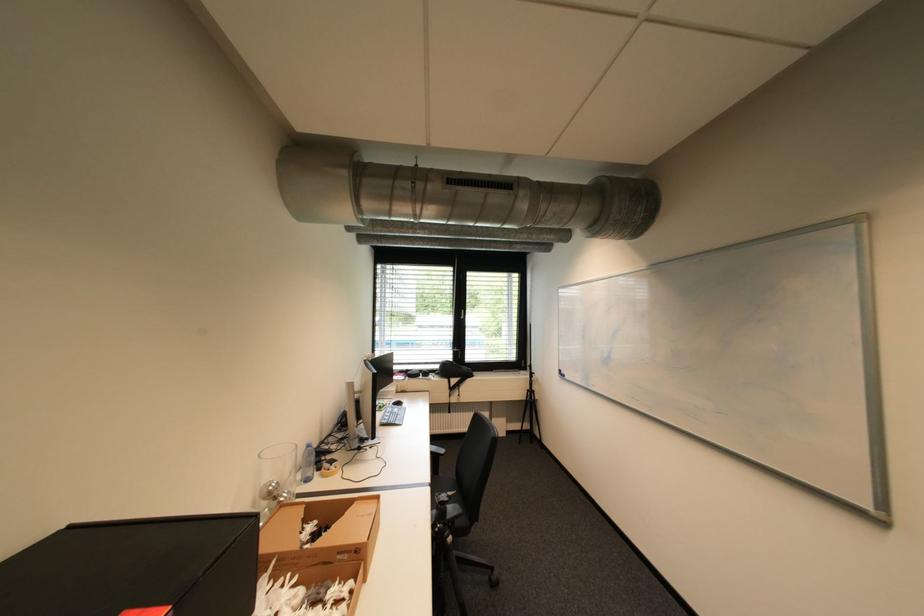
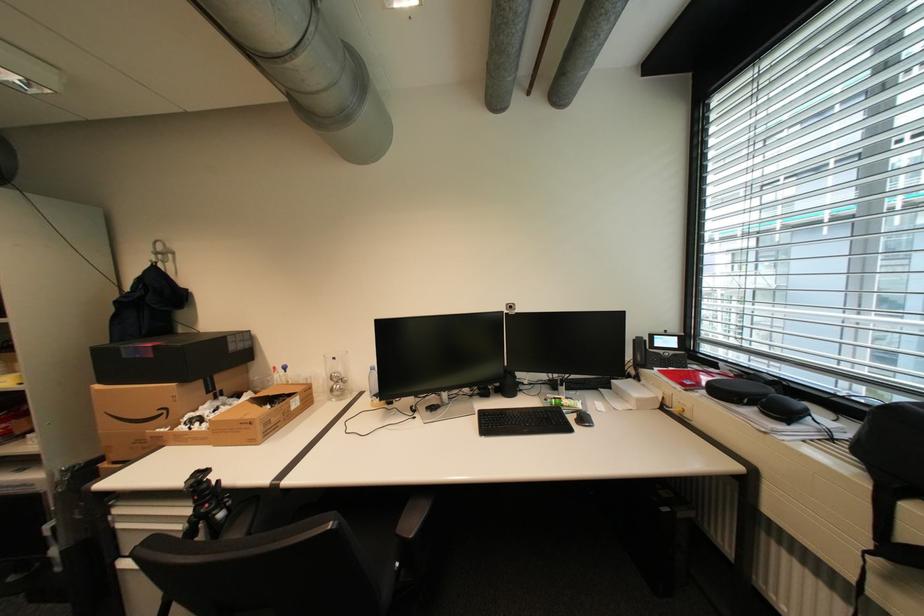
Question: I am providing you with two images of the same scene from different viewpoints. Which of the following objects are not visible in image2?

Choices:
 (A) metal wall hook
 (B) black headphones case
 (C) pink cylinder canister
 (D) black bag

Answer: (D)